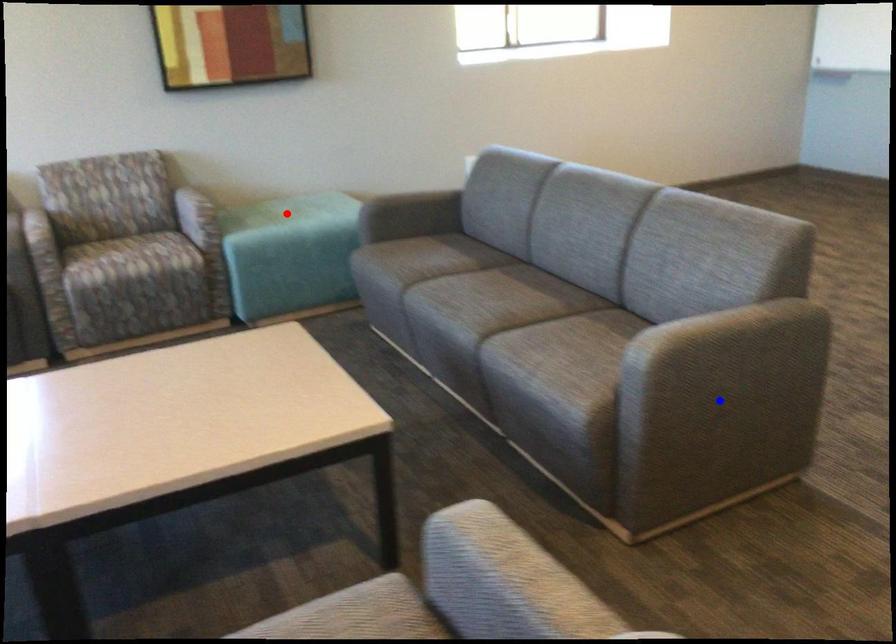
Question: In the image, two points are highlighted. Which point is nearer to the camera? Reply with the corresponding letter.

Choices:
 (A) blue point
 (B) red point

Answer: (A)